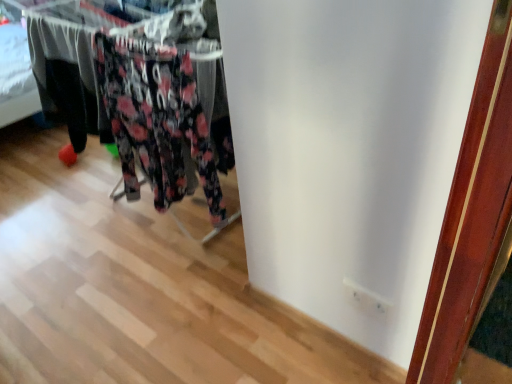
Find the location of a particular element. vacant space underneath floral fabric pants at left (from a real-world perspective) is located at coordinates (155, 233).